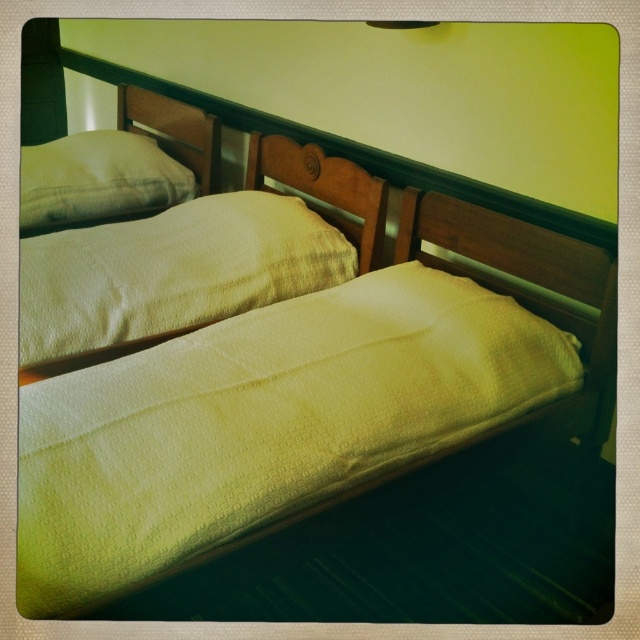
You are arranging a photo shoot in this room and need to place a camera on a stand that is 2 meters wide. You want to position the camera between the white textured pillow at upper left and the wooden headboard at center. Is there enough space between them for the camera stand?

The white textured pillow at upper left is wider than the wooden headboard at center. However, the question is about the space between them, not their individual widths. Since the scene description mentions the beds are placed side by side with headboards against the wall, and the pillow is at upper left while the headboard is at center, the distance between them isn...

You are standing in the room and want to place a small decorative item on the wall directly above the white textured pillow at upper center. Based on the coordinates provided, what are the coordinates where you should place the item?

The coordinates for placing the decorative item directly above the white textured pillow at upper center would be approximately point [172,272].